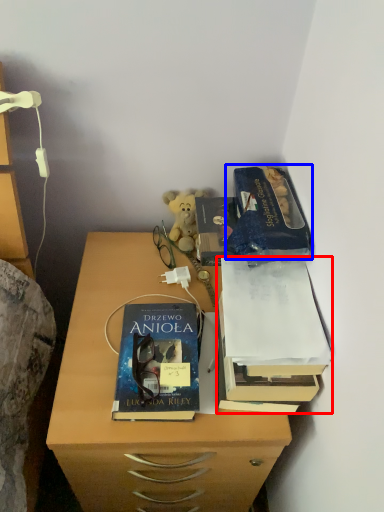
Question: Which of the following is the farthest to the observer, book (highlighted by a red box) or paperback book (highlighted by a blue box)?

Choices:
 (A) book
 (B) paperback book

Answer: (B)